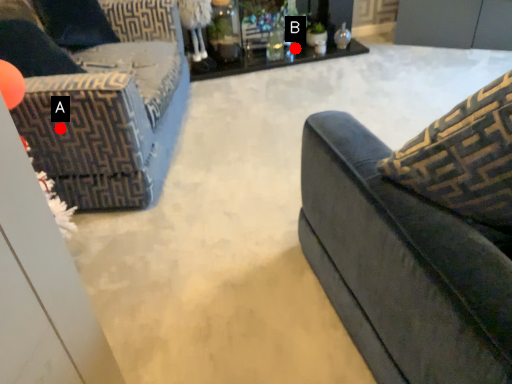
Question: Two points are circled on the image, labeled by A and B beside each circle. Which point is closer to the camera?

Choices:
 (A) A is closer
 (B) B is closer

Answer: (A)